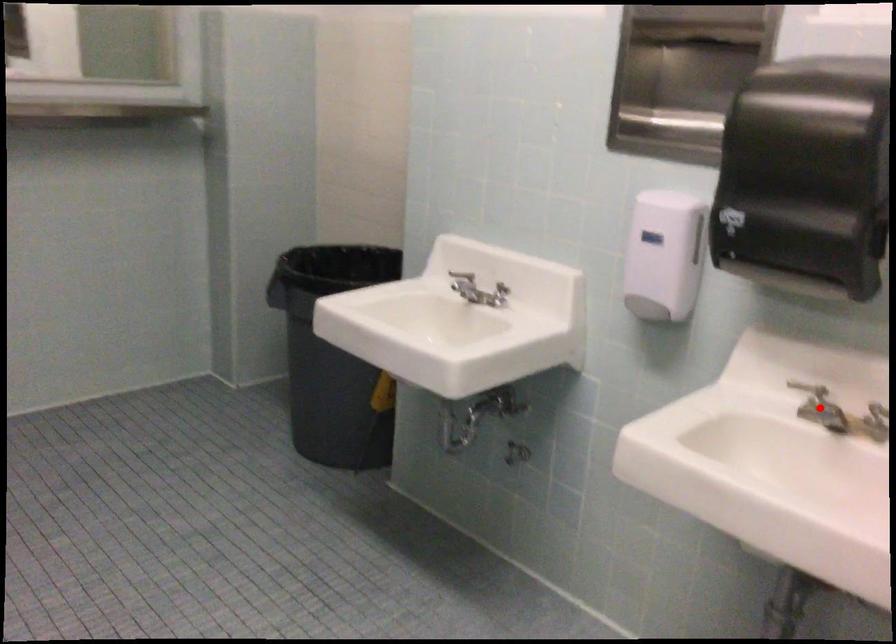
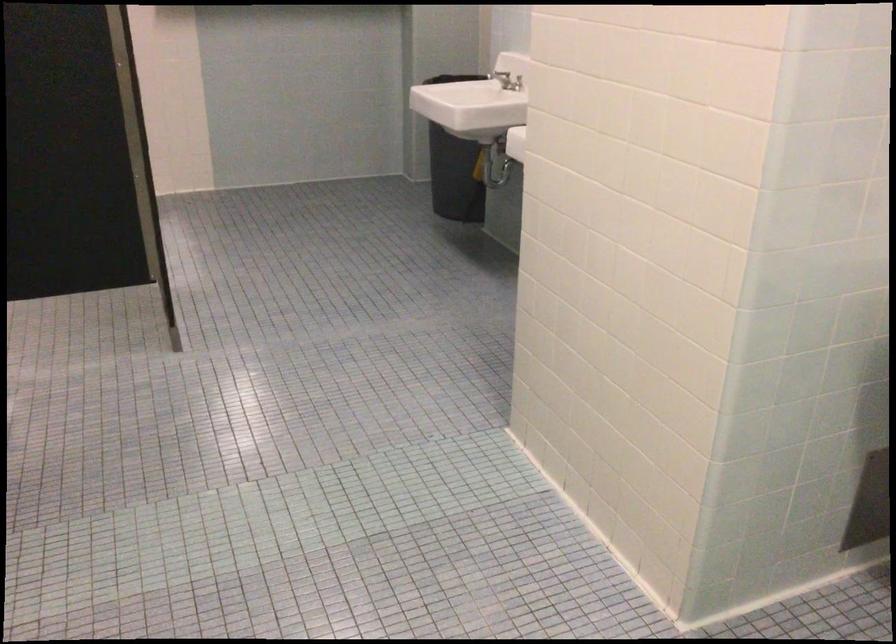
Question: I am providing you with two images of the same scene from different viewpoints. A red point is marked on the first image. At the location where the point appears in image 1, is it still visible in image 2?

Choices:
 (A) Yes
 (B) No

Answer: (B)